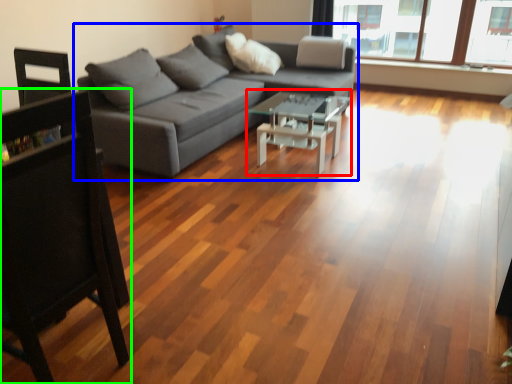
Question: Estimate the real-world distances between objects in this image. Which object is farther from coffee table (highlighted by a red box), studio couch (highlighted by a blue box) or chair (highlighted by a green box)?

Choices:
 (A) studio couch
 (B) chair

Answer: (B)